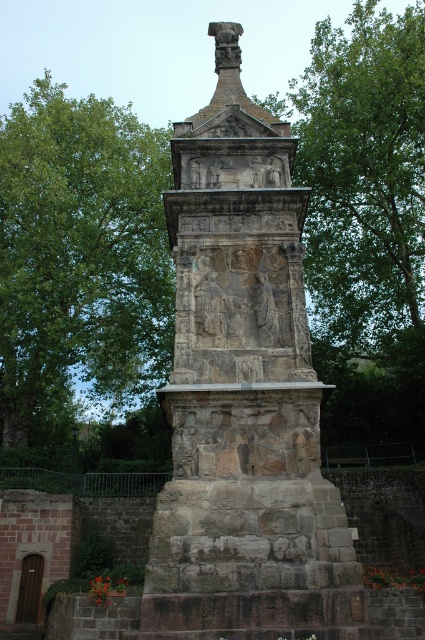
Question: Estimate the real-world distances between objects in this image. Which object is closer to the green leafy tree at upper left?

Choices:
 (A) green leafy tree at upper center
 (B) stone sculpture at center

Answer: (A)

Question: Among these objects, which one is nearest to the camera?

Choices:
 (A) stone sculpture at center
 (B) green leafy tree at upper left
 (C) green leafy tree at upper center
 (D) stone relief carving at center

Answer: (A)

Question: Which point is farther from the camera taking this photo?

Choices:
 (A) (232, 269)
 (B) (198, 605)
 (C) (365, 148)
 (D) (48, 72)

Answer: (D)

Question: Does green leafy tree at upper center have a larger size compared to stone relief figures at center?

Choices:
 (A) no
 (B) yes

Answer: (B)

Question: Does stone sculpture at center have a larger size compared to green leafy tree at upper left?

Choices:
 (A) yes
 (B) no

Answer: (B)

Question: Can you confirm if green leafy tree at upper left is positioned above stone relief carving at center?

Choices:
 (A) no
 (B) yes

Answer: (B)